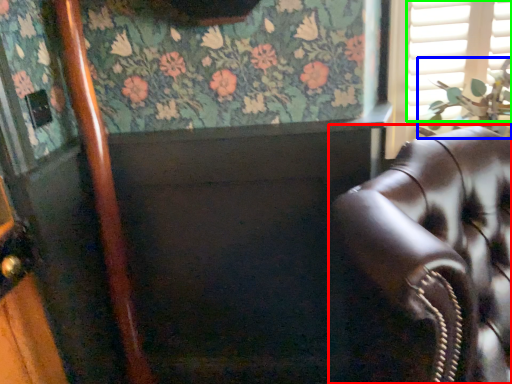
Question: Which is nearer to the chair (highlighted by a red box)? plant (highlighted by a blue box) or shutter (highlighted by a green box).

Choices:
 (A) plant
 (B) shutter

Answer: (A)